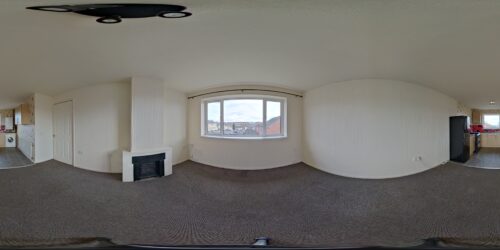
Where is `carpeted floor`? carpeted floor is located at coordinates (284, 203), (121, 207), (41, 201), (372, 204), (472, 201).